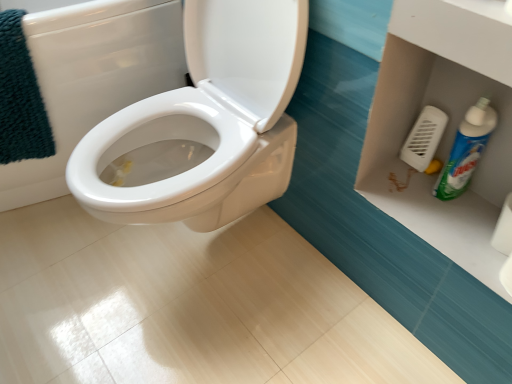
Measure the distance between point (426, 208) and camera.

Point (426, 208) and camera are 37.32 inches apart from each other.

In order to face white plastic shelf at upper right, should I rotate leftwards or rightwards?

Rotate right and turn 24.605 degrees.

Where is `white glossy toilet at center`? This screenshot has height=384, width=512. white glossy toilet at center is located at coordinates (92, 78).

Is white plastic vent at right positioned beyond the bounds of white plastic shelf at upper right?

Yes.

Where is `shelf that appears in front of the white plastic vent at right`? The height and width of the screenshot is (384, 512). shelf that appears in front of the white plastic vent at right is located at coordinates (447, 125).

In terms of height, does white plastic vent at right look taller or shorter compared to white plastic shelf at upper right?

Clearly, white plastic vent at right is taller compared to white plastic shelf at upper right.

From a real-world perspective, is white plastic vent at right under white plastic shelf at upper right?

Incorrect, from a real-world perspective, white plastic vent at right is higher than white plastic shelf at upper right.

Is green plastic bottle at lower right to the left or to the right of white plastic vent at right in the image?

Based on their positions, green plastic bottle at lower right is located to the right of white plastic vent at right.

From a real-world perspective, is green plastic bottle at lower right above or below white plastic vent at right?

green plastic bottle at lower right is above white plastic vent at right.

The image size is (512, 384). I want to click on towel bar above the green plastic bottle at lower right (from the image's perspective), so click(x=424, y=139).

Considering the sizes of green plastic bottle at lower right and white plastic vent at right in the image, is green plastic bottle at lower right wider or thinner than white plastic vent at right?

Clearly, green plastic bottle at lower right has more width compared to white plastic vent at right.

Who is smaller, white plastic vent at right or teal plush bath towel at upper left?

Smaller between the two is white plastic vent at right.

From the image's perspective, does white plastic vent at right appear higher than teal plush bath towel at upper left?

No, from the image's perspective, white plastic vent at right is not above teal plush bath towel at upper left.

Is point (438, 127) positioned after point (32, 134)?

That is False.

The width and height of the screenshot is (512, 384). In order to click on towel bar in front of the teal plush bath towel at upper left in this screenshot , I will do `click(424, 139)`.

The width and height of the screenshot is (512, 384). Find the location of `bath behind the white plastic shelf at upper right`. bath behind the white plastic shelf at upper right is located at coordinates (92, 78).

Which object is positioned more to the right, white glossy toilet at center or white plastic shelf at upper right?

From the viewer's perspective, white plastic shelf at upper right appears more on the right side.

Is white glossy toilet at center looking in the opposite direction of white plastic shelf at upper right?

white glossy toilet at center does not have its back to white plastic shelf at upper right.

Does white glossy toilet at center have a greater height compared to white plastic vent at right?

Yes, white glossy toilet at center is taller than white plastic vent at right.

Is white glossy toilet at center positioned behind white plastic vent at right?

No, it is in front of white plastic vent at right.

Is white glossy toilet at center positioned far away from white plastic vent at right?

white glossy toilet at center is near white plastic vent at right, not far away.

Between white glossy toilet at center and white plastic vent at right, which one appears on the right side from the viewer's perspective?

Positioned to the right is white plastic vent at right.

Find the location of a particular element. towel bar behind the white plastic shelf at upper right is located at coordinates (424, 139).

Considering the relative positions of white plastic shelf at upper right and white plastic vent at right in the image provided, is white plastic shelf at upper right to the left or to the right of white plastic vent at right?

Clearly, white plastic shelf at upper right is on the right of white plastic vent at right in the image.

How different are the orientations of white plastic shelf at upper right and white plastic vent at right in degrees?

The angle between the facing direction of white plastic shelf at upper right and the facing direction of white plastic vent at right is 1.46 degrees.

Is white plastic shelf at upper right closer to the viewer compared to white plastic vent at right?

Yes, white plastic shelf at upper right is closer to the camera.

Visually, is white plastic vent at right positioned to the left or to the right of green plastic bottle at lower right?

Based on their positions, white plastic vent at right is located to the left of green plastic bottle at lower right.

Is white plastic vent at right oriented away from green plastic bottle at lower right?

No.

Is white plastic vent at right far away from green plastic bottle at lower right?

That's not correct — white plastic vent at right is a little close to green plastic bottle at lower right.

Is white plastic vent at right wider than green plastic bottle at lower right?

No.

Find the location of a particular element. This screenshot has width=512, height=384. towel bar that is behind the white plastic shelf at upper right is located at coordinates (424, 139).

Locate an element on the screen. This screenshot has height=384, width=512. towel bar on the left of green plastic bottle at lower right is located at coordinates (424, 139).

From the image, which object appears to be farther from green plastic bottle at lower right, teal plush bath towel at upper left or white plastic vent at right?

teal plush bath towel at upper left.

From the image, which object appears to be nearer to green plastic bottle at lower right, teal plush bath towel at upper left or white plastic shelf at upper right?

white plastic shelf at upper right is closer to green plastic bottle at lower right.

Looking at the image, which one is located closer to white plastic shelf at upper right, white plastic vent at right or white glossy toilet at center?

white plastic vent at right.

Estimate the real-world distances between objects in this image. Which object is further from white plastic vent at right, teal plush bath towel at upper left or white glossy toilet at center?

teal plush bath towel at upper left.

From the image, which object appears to be farther from white glossy toilet at center, white plastic vent at right or teal plush bath towel at upper left?

Among the two, white plastic vent at right is located further to white glossy toilet at center.

Considering their positions, is white plastic shelf at upper right positioned further to green plastic bottle at lower right than white glossy toilet at center?

The object further to green plastic bottle at lower right is white glossy toilet at center.

Estimate the real-world distances between objects in this image. Which object is closer to green plastic bottle at lower right, teal plush bath towel at upper left or white glossy toilet at center?

white glossy toilet at center lies closer to green plastic bottle at lower right than the other object.

Estimate the real-world distances between objects in this image. Which object is closer to white plastic shelf at upper right, green plastic bottle at lower right or white plastic vent at right?

green plastic bottle at lower right is closer to white plastic shelf at upper right.

Where is `shelf between teal plush bath towel at upper left and green plastic bottle at lower right from left to right`? Image resolution: width=512 pixels, height=384 pixels. shelf between teal plush bath towel at upper left and green plastic bottle at lower right from left to right is located at coordinates (447, 125).

Identify the location of towel bar between teal plush bath towel at upper left and white plastic shelf at upper right in the horizontal direction. (424, 139).

Find the location of a particular element. The height and width of the screenshot is (384, 512). bath towel between white glossy toilet at center and green plastic bottle at lower right from left to right is located at coordinates (20, 97).

The height and width of the screenshot is (384, 512). I want to click on bath towel between white glossy toilet at center and white plastic shelf at upper right, so click(x=20, y=97).